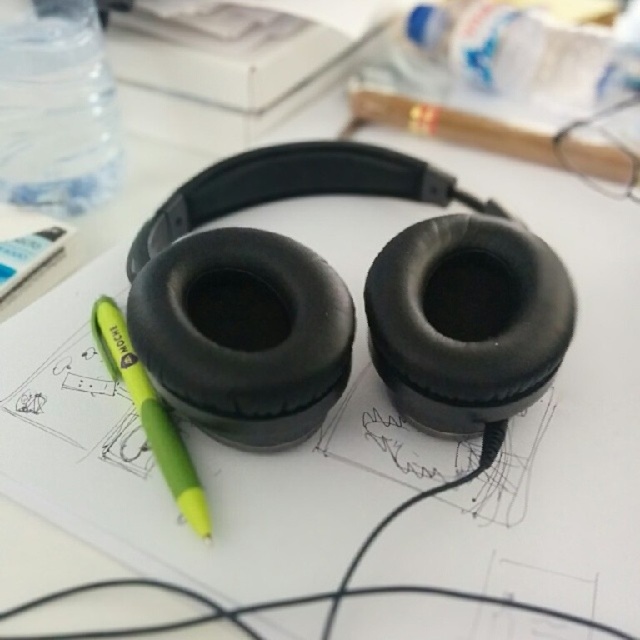
Is point (44, 198) farther from camera compared to point (172, 470)?

Yes, point (44, 198) is farther from viewer.

Locate an element on the screen. This screenshot has height=640, width=640. transparent plastic bottle at upper left is located at coordinates (56, 109).